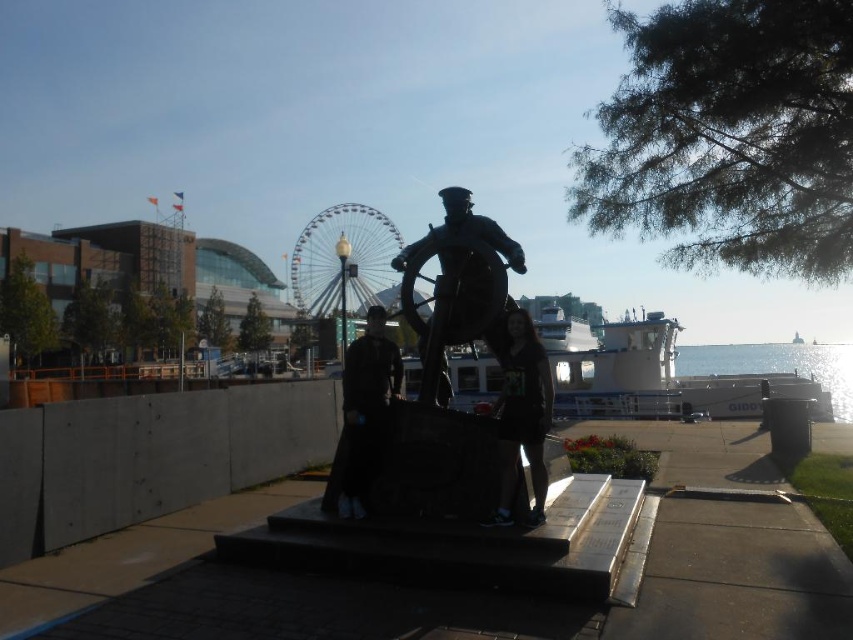
You are standing at the center of the waterfront scene. There is a bronze statue at center. Where is the point located at coordinates point (460,285)?

The point located at coordinates point 0.440, 0.540 is on bronze statue at center.

Based on the photo, you are a photographer trying to capture the statue and the individuals beside it. You notice the dark gray fabric dress at center and the glistening silver water at lower right in your frame. Which object is closer to the camera? Please explain based on their positions.

The dark gray fabric dress at center is closer to the camera because it is positioned in front of the glistening silver water at lower right.

You are a photographer trying to capture the shiny metallic ferris wheel at center and the dark gray fabric jacket at center in the same frame. Which object should you focus on first to ensure both are in the frame without moving the camera?

The shiny metallic ferris wheel at center is positioned under the dark gray fabric jacket at center, so you should focus on the dark gray fabric jacket at center first to ensure both are in the frame without moving the camera.